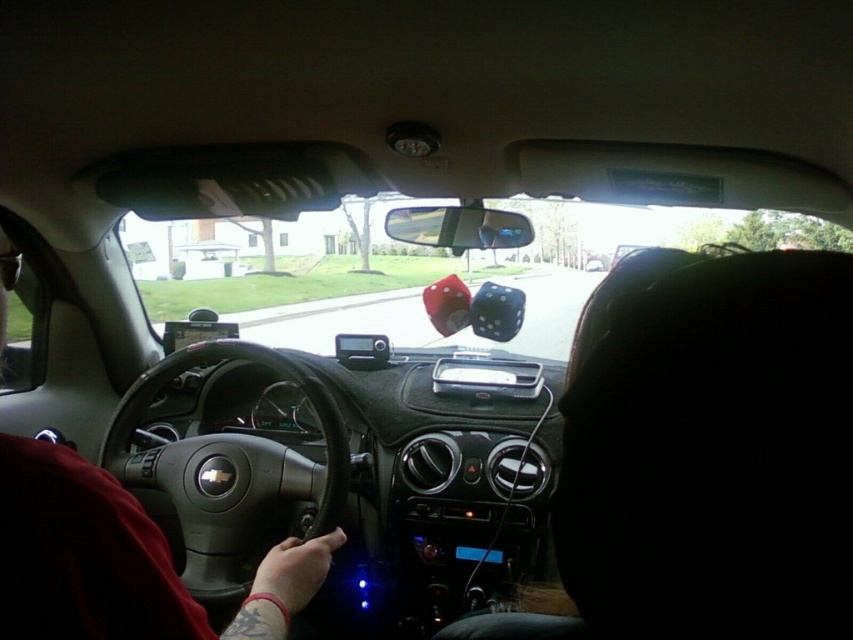
Can you confirm if black fabric headrest at upper right is bigger than dark red leather jacket at lower left?

Correct, black fabric headrest at upper right is larger in size than dark red leather jacket at lower left.

Is point (689, 376) in front of point (242, 611)?

Yes, it is.

Is point (807, 602) positioned behind point (25, 596)?

No, it is in front of (25, 596).

The height and width of the screenshot is (640, 853). Find the location of `black fabric headrest at upper right`. black fabric headrest at upper right is located at coordinates (706, 458).

Can you confirm if dark red leather jacket at lower left is wider than matte black steering wheel at center?

No, dark red leather jacket at lower left is not wider than matte black steering wheel at center.

The width and height of the screenshot is (853, 640). In order to click on dark red leather jacket at lower left in this screenshot , I will do `click(119, 560)`.

Based on the photo, between black fabric headrest at upper right and matte black steering wheel at center, which one has more height?

With more height is black fabric headrest at upper right.

The image size is (853, 640). What do you see at coordinates (706, 458) in the screenshot? I see `black fabric headrest at upper right` at bounding box center [706, 458].

Where is `black fabric headrest at upper right`? black fabric headrest at upper right is located at coordinates coord(706,458).